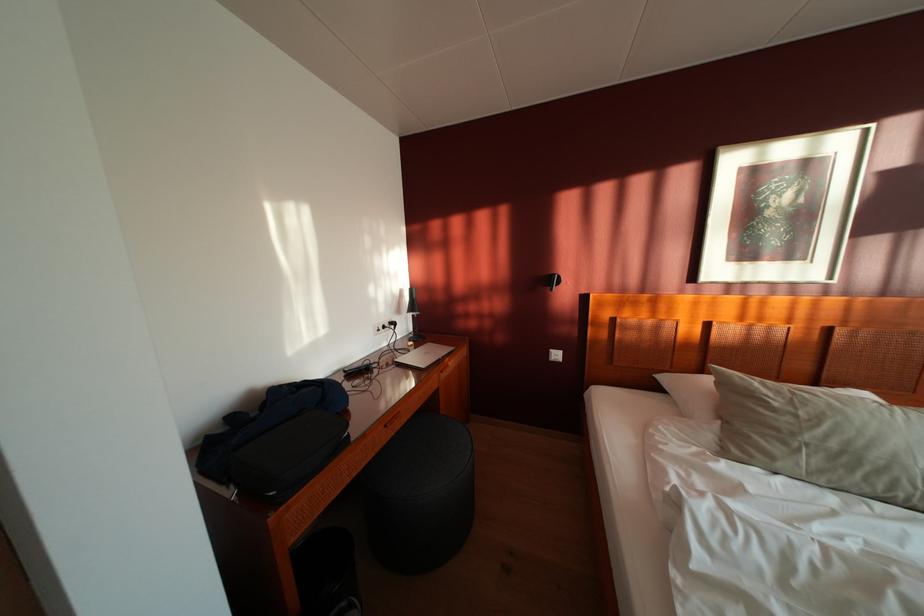
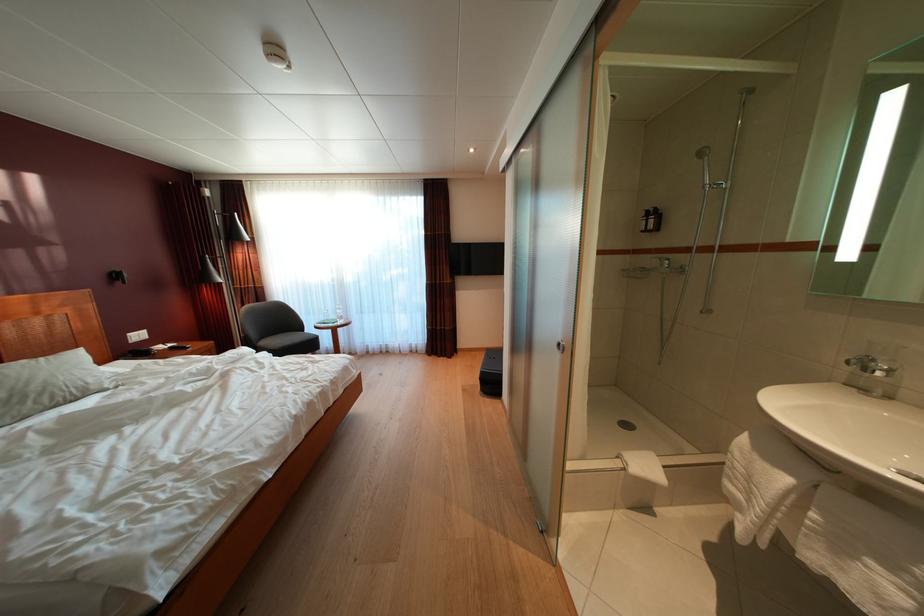
Find the pixel in the second image that matches [843,451] in the first image.

(10, 400)